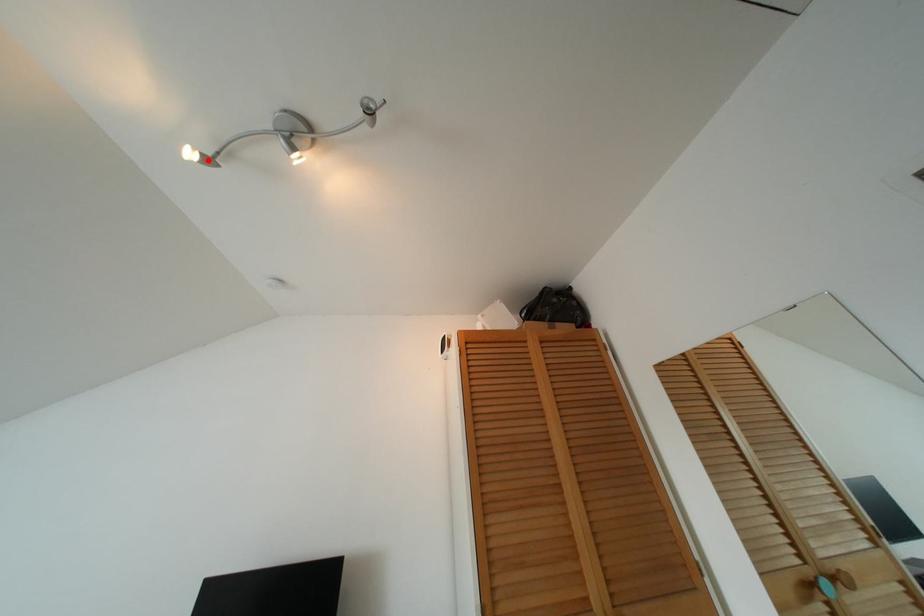
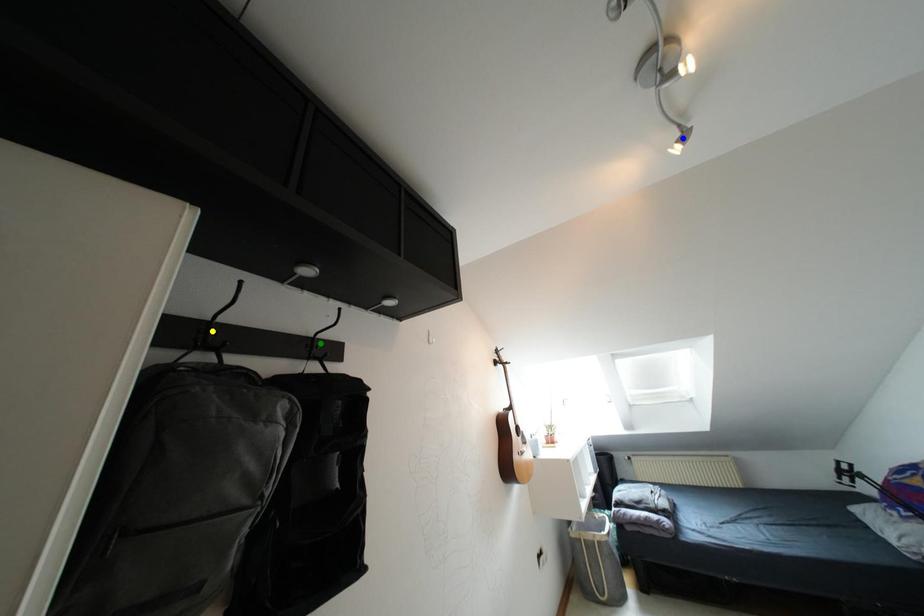
Question: I am providing you with two images of the same scene from different viewpoints. A red point is marked on the first image. You are given multiple points on the second image. In image 2, which mark is for the same physical point as the one in image 1?

Choices:
 (A) green point
 (B) blue point
 (C) yellow point

Answer: (B)